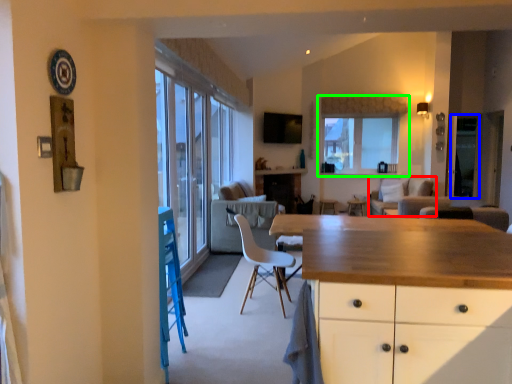
Question: Considering the real-world distances, which object is farthest from couch (highlighted by a red box)? window screen (highlighted by a blue box) or window (highlighted by a green box)?

Choices:
 (A) window screen
 (B) window

Answer: (B)